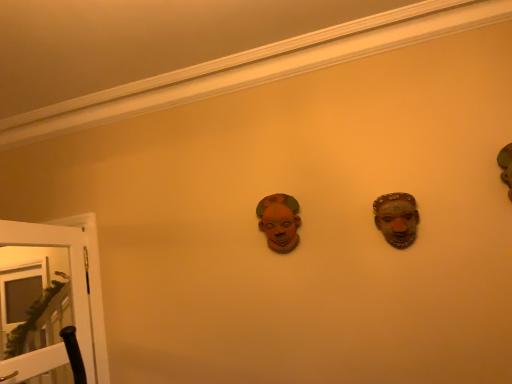
Question: Is white glossy door at lower left further to camera compared to matte brown mask at center?

Choices:
 (A) no
 (B) yes

Answer: (A)

Question: Does white glossy door at lower left have a lesser height compared to matte brown mask at center?

Choices:
 (A) yes
 (B) no

Answer: (B)

Question: Considering the relative positions of white glossy door at lower left and matte brown mask at center in the image provided, is white glossy door at lower left to the left of matte brown mask at center from the viewer's perspective?

Choices:
 (A) yes
 (B) no

Answer: (A)

Question: Can you confirm if white glossy door at lower left is positioned to the right of matte brown mask at center?

Choices:
 (A) no
 (B) yes

Answer: (A)

Question: Considering the relative sizes of white glossy door at lower left and matte brown mask at center in the image provided, is white glossy door at lower left taller than matte brown mask at center?

Choices:
 (A) no
 (B) yes

Answer: (B)

Question: Does white glossy door at lower left have a greater width compared to matte brown mask at center?

Choices:
 (A) no
 (B) yes

Answer: (B)

Question: Is the position of matte brown mask at center less distant than that of white glossy door at lower left?

Choices:
 (A) yes
 (B) no

Answer: (B)

Question: Are matte brown mask at center and white glossy door at lower left located far from each other?

Choices:
 (A) yes
 (B) no

Answer: (A)

Question: Considering the relative sizes of matte brown mask at center and white glossy door at lower left in the image provided, is matte brown mask at center taller than white glossy door at lower left?

Choices:
 (A) yes
 (B) no

Answer: (B)

Question: Is matte brown mask at center looking in the opposite direction of white glossy door at lower left?

Choices:
 (A) yes
 (B) no

Answer: (B)

Question: Is matte brown mask at center shorter than white glossy door at lower left?

Choices:
 (A) no
 (B) yes

Answer: (B)

Question: Can you confirm if matte brown mask at center is bigger than white glossy door at lower left?

Choices:
 (A) yes
 (B) no

Answer: (B)

Question: Looking at their shapes, would you say matte brown mask at center is wider or thinner than white glossy door at lower left?

Choices:
 (A) wide
 (B) thin

Answer: (B)